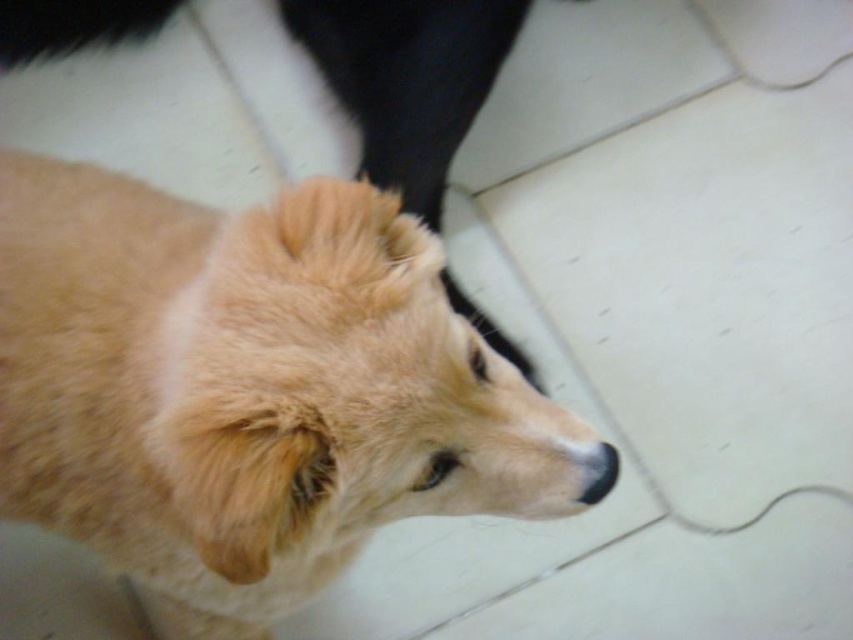
Question: Can you confirm if fuzzy golden dog at center is bigger than golden fur dog at center?

Choices:
 (A) no
 (B) yes

Answer: (B)

Question: Which point is farther from the camera taking this photo?

Choices:
 (A) (82, 396)
 (B) (338, 8)

Answer: (B)

Question: Which object appears closest to the camera in this image?

Choices:
 (A) golden fur dog at center
 (B) fuzzy golden dog at center

Answer: (B)

Question: Which of the following is the farthest from the observer?

Choices:
 (A) (202, 413)
 (B) (398, 170)

Answer: (B)

Question: Can you confirm if fuzzy golden dog at center is positioned below golden fur dog at center?

Choices:
 (A) no
 (B) yes

Answer: (B)

Question: Can you confirm if fuzzy golden dog at center is bigger than golden fur dog at center?

Choices:
 (A) no
 (B) yes

Answer: (B)